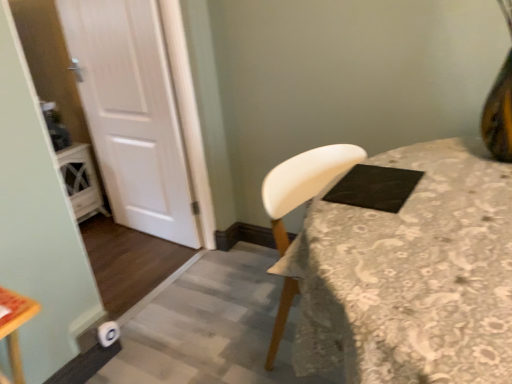
Question: Is white fabric-covered table at center wider or thinner than white wood door at left?

Choices:
 (A) thin
 (B) wide

Answer: (B)

Question: Based on their sizes in the image, would you say white fabric-covered table at center is bigger or smaller than white wood door at left?

Choices:
 (A) small
 (B) big

Answer: (B)

Question: Which of these objects is positioned farthest from the white fabric-covered table at center?

Choices:
 (A) black matte pad at upper right
 (B) white wood door at left

Answer: (B)

Question: Estimate the real-world distances between objects in this image. Which object is closer to the white wood door at left?

Choices:
 (A) black matte pad at upper right
 (B) white fabric-covered table at center

Answer: (A)